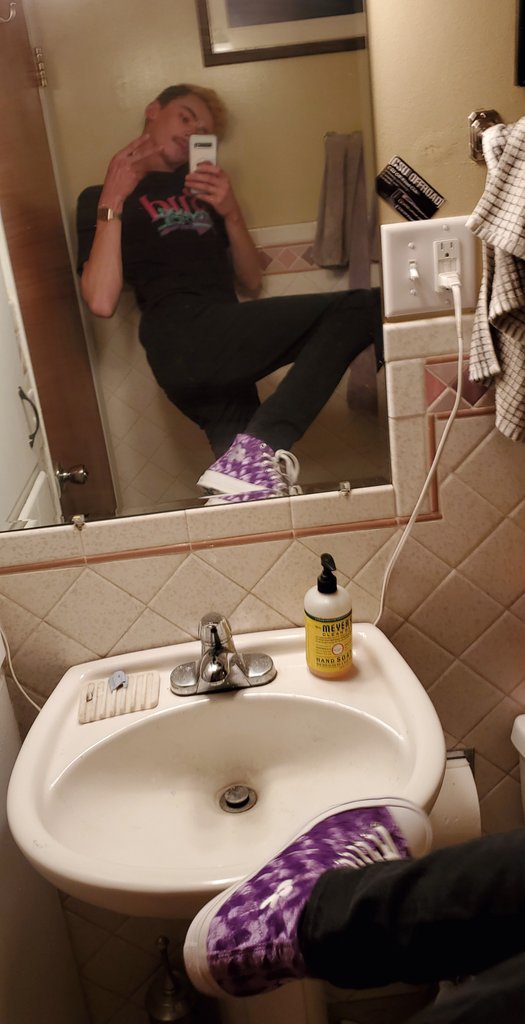
Identify the location of towel. This screenshot has height=1024, width=525. (514, 186).